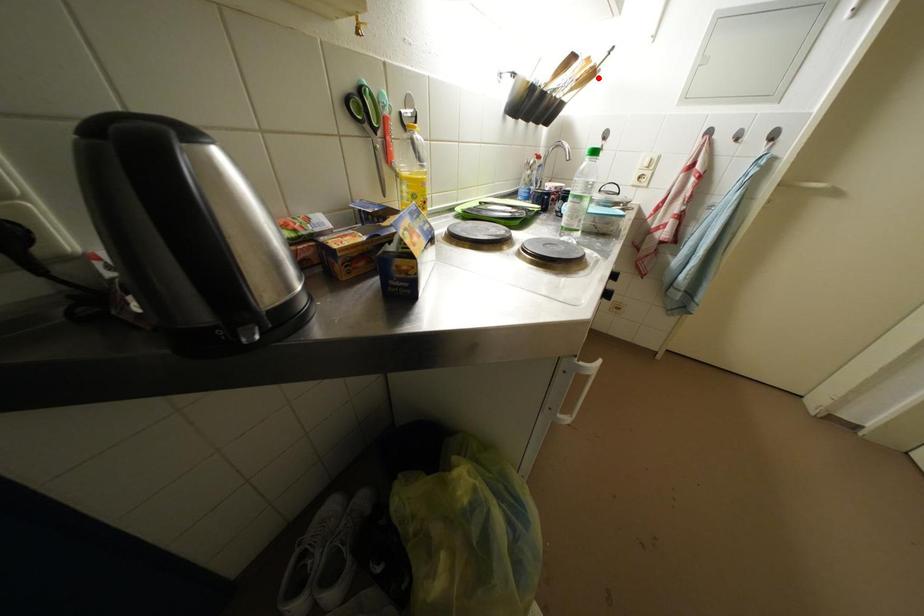
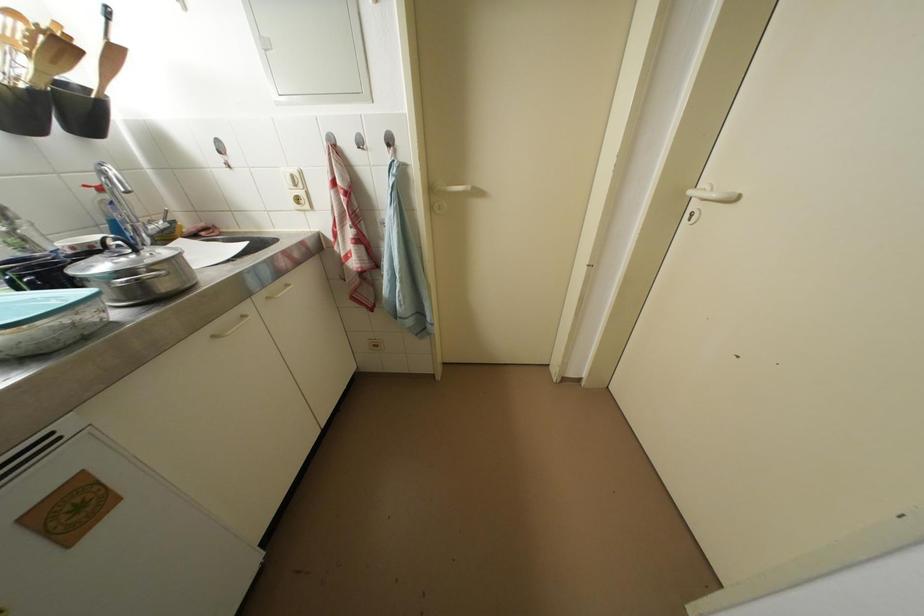
Locate, in the second image, the point that corresponds to the highlighted location in the first image.

(69, 50)